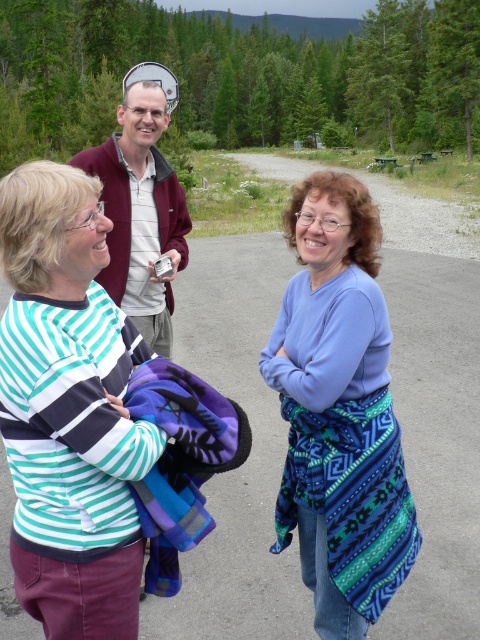
You are organizing a picnic and need to decide which item can better cover a larger group. Based on the image, which object between the blue woven shawl at center and the maroon fleece jacket at upper center is bigger in size?

The blue woven shawl at center is larger in size compared to the maroon fleece jacket at upper center, so it can better cover a larger group.

You are standing at the origin of the coordinate system in the image. There is a striped cotton shirt at left located at point (69,410). What direction should you move to reach the striped cotton shirt at left?

To reach the striped cotton shirt at left located at point (69,410) from the origin, you should move towards the right and upwards since the x and y coordinates are both positive compared to the origin.

You are a photographer trying to capture a candid shot of the striped cotton shirt at left and the blue woven shawl at center. Your camera has a maximum focus range of 28 inches. Can you fit both subjects within the focus range without moving the camera?

The striped cotton shirt at left and blue woven shawl at center are 28.56 inches apart from each other. Since the distance between them exceeds the camera focus range of 28 inches, you cannot fit both within the focus range without moving the camera.